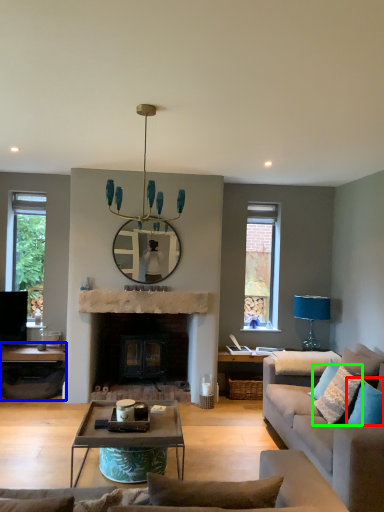
Question: Which object is positioned closest to pillow (highlighted by a red box)? Select from table (highlighted by a blue box) and pillow (highlighted by a green box).

Choices:
 (A) table
 (B) pillow

Answer: (B)